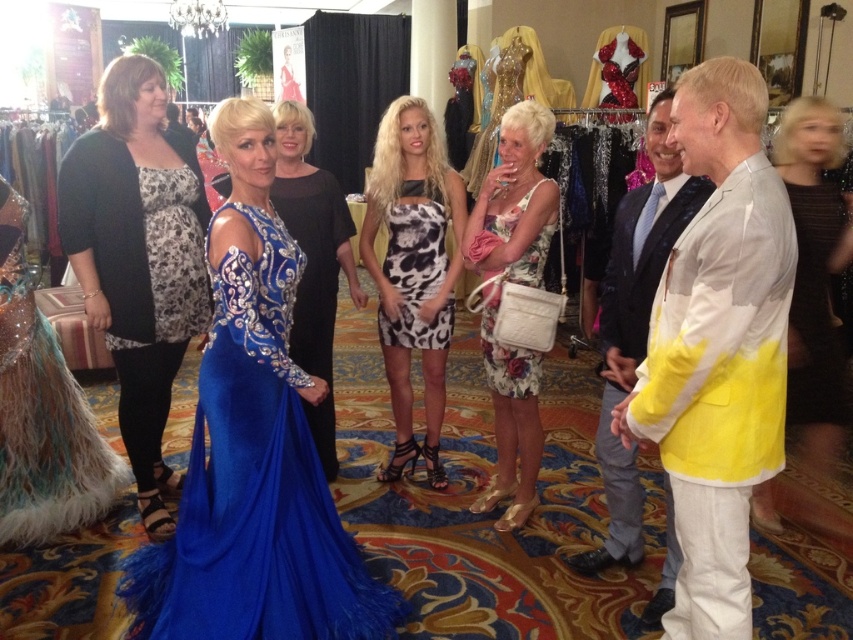
Question: Which point is farther to the camera?

Choices:
 (A) (30, 323)
 (B) (705, 548)
 (C) (323, 568)
 (D) (834, 186)

Answer: (D)

Question: Is printed fabric dress at center thinner than satin black dress at center?

Choices:
 (A) no
 (B) yes

Answer: (A)

Question: In this image, where is blue sequined dress at center located relative to brown textured dress at right?

Choices:
 (A) left
 (B) right

Answer: (A)

Question: Which object is closer to the camera taking this photo?

Choices:
 (A) black and white leopard print dress at center
 (B) satin black dress at center

Answer: (B)

Question: Which object is positioned farthest from the floral fabric dress at center?

Choices:
 (A) white satin dress at right
 (B) shiny blue gown at center
 (C) printed fabric dress at center

Answer: (B)

Question: Is yellow and white fabric jacket at right bigger than white satin dress at right?

Choices:
 (A) no
 (B) yes

Answer: (B)